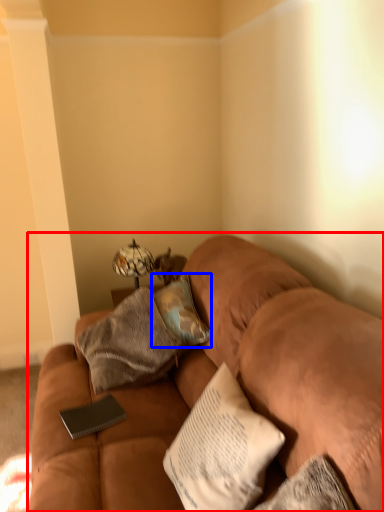
Question: Which object appears closest to the camera in this image, studio couch (highlighted by a red box) or pillow (highlighted by a blue box)?

Choices:
 (A) studio couch
 (B) pillow

Answer: (A)